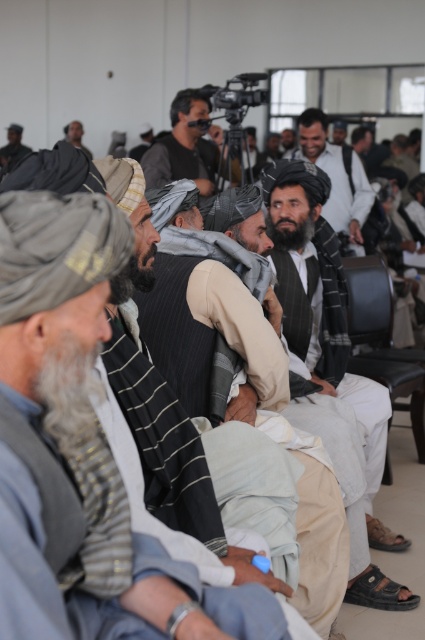
Question: Can you confirm if light beige fabric at center is smaller than black leather chair at right?

Choices:
 (A) yes
 (B) no

Answer: (A)

Question: Is black leather chair at right below matte black camera at center?

Choices:
 (A) yes
 (B) no

Answer: (A)

Question: Which point is closer to the camera?

Choices:
 (A) dark gray woolen turban at upper left
 (B) black leather chair at right
 (C) light brown woolen scarf at center

Answer: (A)

Question: Does light beige fabric at center lie behind black leather chair at right?

Choices:
 (A) yes
 (B) no

Answer: (B)

Question: Which of the following is the farthest from the observer?

Choices:
 (A) light beige fabric at center
 (B) matte black jacket at center

Answer: (B)

Question: Which object is closer to the camera taking this photo?

Choices:
 (A) matte black camera at center
 (B) light brown woolen scarf at center
 (C) light beige fabric at center

Answer: (C)